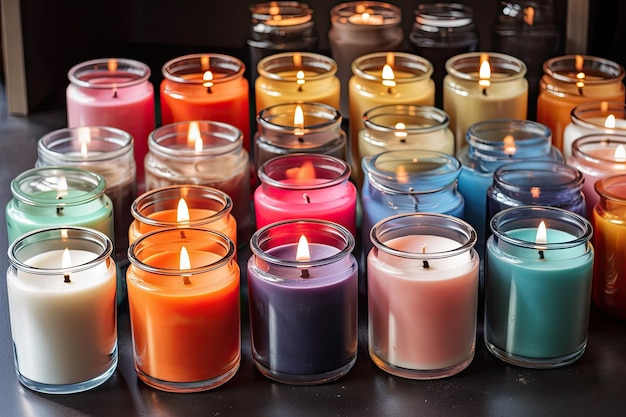
This screenshot has height=417, width=626. What are the coordinates of `the bottom row of candles` in the screenshot? It's located at (x=74, y=326), (x=208, y=316), (x=290, y=314), (x=414, y=310), (x=550, y=298).